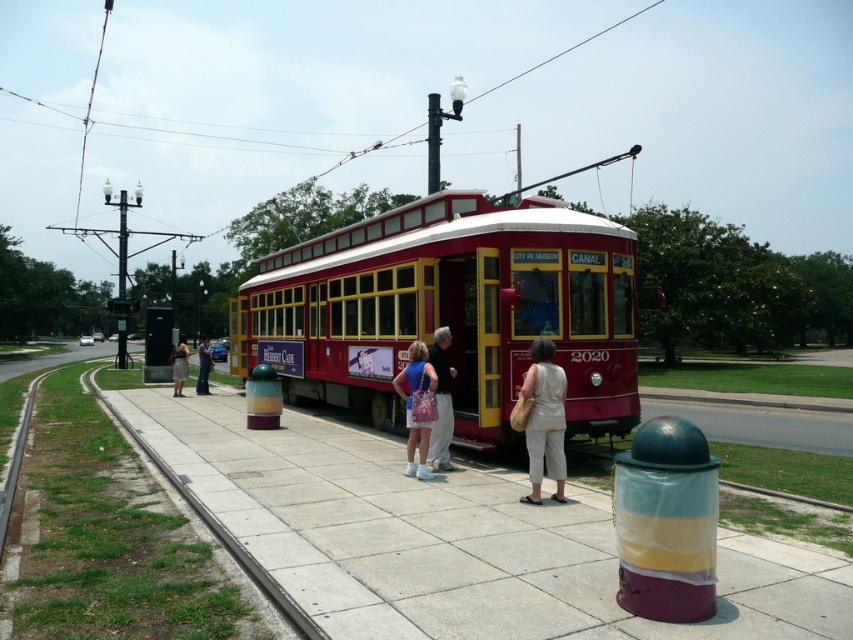
You are standing at the point closer to the camera in the image. Which point are you at, point (509, 387) or point (165, 371)?

You are at point (509, 387) because it is closer to the camera than point (165, 371).

You are a fashion designer observing the streetcar scene and notice two denim garments. Which one is taller, the denim shorts at center or the denim skirt at left?

The denim shorts at center is taller than the denim skirt at left.

You are a fashion designer observing the crowd at the streetcar scene. You notice two people wearing denim shorts at center and denim skirt at left. Which clothing item is positioned higher relative to the other?

The denim shorts at center is positioned higher than the denim skirt at left.